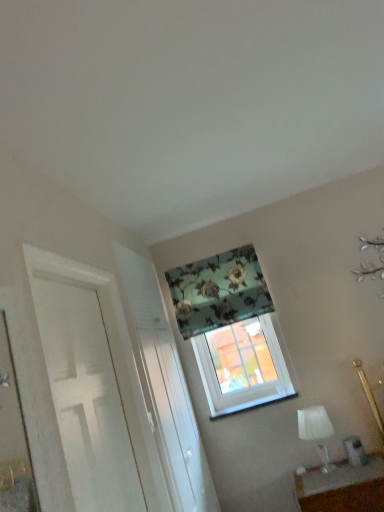
Question: From a real-world perspective, is translucent glass window at center positioned over white glass table lamp at lower right based on gravity?

Choices:
 (A) no
 (B) yes

Answer: (B)

Question: Is translucent glass window at center positioned before white glass table lamp at lower right?

Choices:
 (A) yes
 (B) no

Answer: (B)

Question: Is the position of translucent glass window at center more distant than that of white glass table lamp at lower right?

Choices:
 (A) no
 (B) yes

Answer: (B)

Question: From a real-world perspective, is translucent glass window at center below white glass table lamp at lower right?

Choices:
 (A) no
 (B) yes

Answer: (A)

Question: Considering the relative positions of translucent glass window at center and white glass table lamp at lower right in the image provided, is translucent glass window at center to the right of white glass table lamp at lower right from the viewer's perspective?

Choices:
 (A) no
 (B) yes

Answer: (A)

Question: Could you tell me if translucent glass window at center is turned towards white glass table lamp at lower right?

Choices:
 (A) no
 (B) yes

Answer: (A)

Question: From a real-world perspective, is matte white table at lower right below white textured screen door at center?

Choices:
 (A) no
 (B) yes

Answer: (B)

Question: Considering the relative sizes of matte white table at lower right and white textured screen door at center in the image provided, is matte white table at lower right shorter than white textured screen door at center?

Choices:
 (A) no
 (B) yes

Answer: (B)

Question: Is matte white table at lower right positioned beyond the bounds of white textured screen door at center?

Choices:
 (A) yes
 (B) no

Answer: (A)

Question: Is matte white table at lower right at the left side of white textured screen door at center?

Choices:
 (A) yes
 (B) no

Answer: (B)

Question: Is matte white table at lower right beside white textured screen door at center?

Choices:
 (A) yes
 (B) no

Answer: (B)

Question: Does matte white table at lower right have a lesser width compared to white textured screen door at center?

Choices:
 (A) yes
 (B) no

Answer: (B)

Question: From a real-world perspective, does floral fabric curtain at upper center sit lower than white painted wood door at left?

Choices:
 (A) yes
 (B) no

Answer: (B)